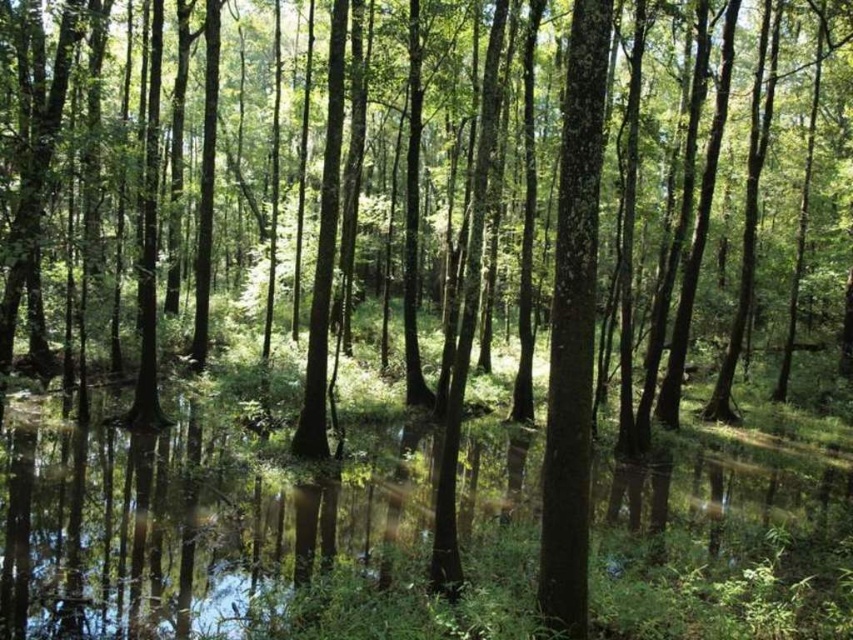
Does smooth bark tree at center come in front of clear water at center?

No.

The width and height of the screenshot is (853, 640). I want to click on smooth bark tree at center, so click(527, 198).

Where is `smooth bark tree at center`? Image resolution: width=853 pixels, height=640 pixels. smooth bark tree at center is located at coordinates (527, 198).